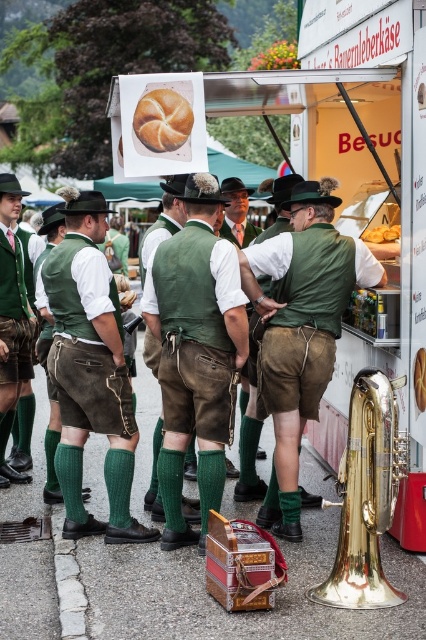
Question: Which of the following is the farthest from the observer?

Choices:
 (A) green woolen vest at center
 (B) green wool vest at center
 (C) green suede vest at center

Answer: (A)

Question: Which point appears closest to the camera in this image?

Choices:
 (A) (187, 516)
 (B) (224, 401)
 (C) (391, 589)

Answer: (C)

Question: Does matte white food truck at center have a greater width compared to green suede vest at center?

Choices:
 (A) no
 (B) yes

Answer: (B)

Question: Is green suede vest at center smaller than brown matte bagel at center?

Choices:
 (A) yes
 (B) no

Answer: (B)

Question: Estimate the real-world distances between objects in this image. Which object is closer to the matte green vest at left?

Choices:
 (A) gold brass trumpet at lower right
 (B) green fabric vest at center
 (C) brown matte bagel at center

Answer: (C)

Question: Is matte white food truck at center further to the viewer compared to green woolen vest at center?

Choices:
 (A) no
 (B) yes

Answer: (A)